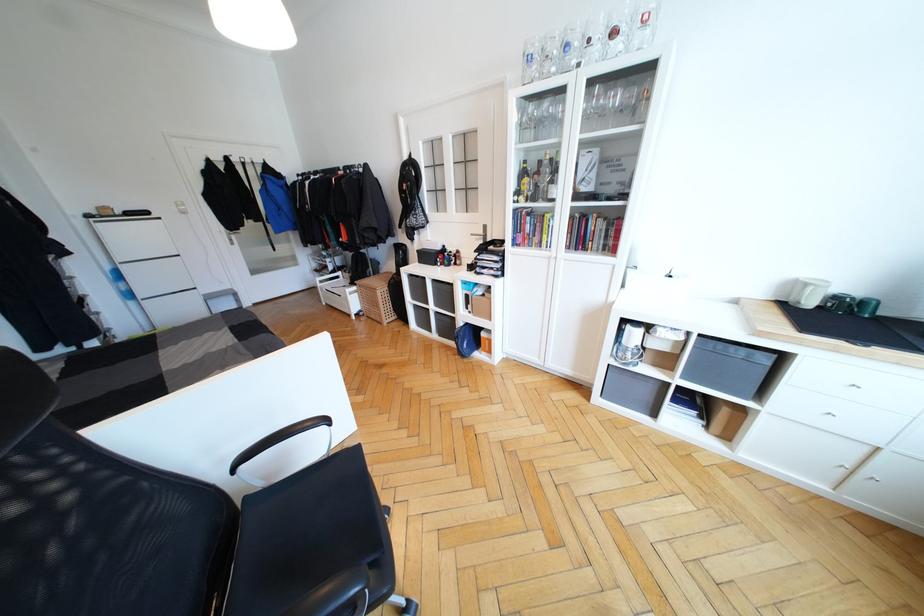
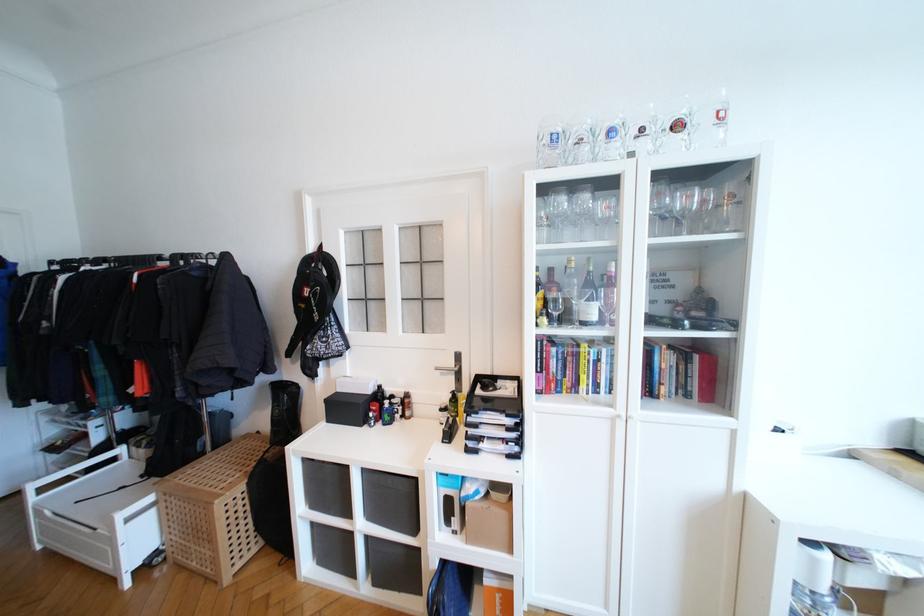
Where in the second image is the point corresponding to point 621,99 from the first image?

(691, 200)